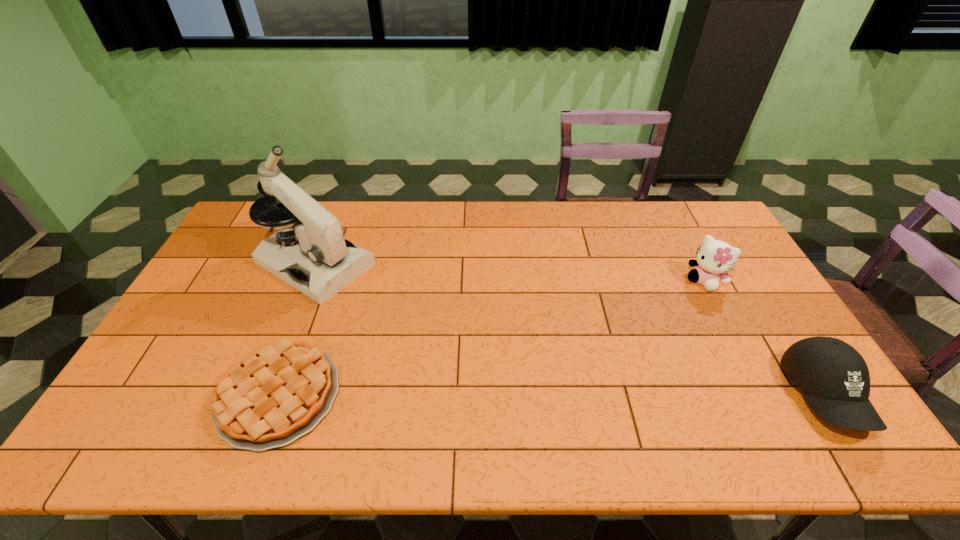
Where is `vacant region located 0.180m at the eyepiece of the microscope`? The height and width of the screenshot is (540, 960). vacant region located 0.180m at the eyepiece of the microscope is located at coordinates (401, 312).

Where is `blank space located at the eyepiece of the microscope`? blank space located at the eyepiece of the microscope is located at coordinates (458, 345).

Identify the location of free space located at the eyepiece of the microscope. (370, 293).

The width and height of the screenshot is (960, 540). In order to click on object that is at the far edge in this screenshot , I will do `click(323, 263)`.

Identify the location of pie at the near edge. (272, 396).

Find the location of a particular element. The width and height of the screenshot is (960, 540). baseball cap that is positioned at the near edge is located at coordinates (835, 379).

What are the coordinates of `object positioned at the left edge` in the screenshot? It's located at (323, 263).

Locate an element on the screen. The height and width of the screenshot is (540, 960). baseball cap located at the right edge is located at coordinates (835, 379).

This screenshot has width=960, height=540. I want to click on kitten present at the right edge, so click(714, 258).

Where is `object that is at the far left corner`? object that is at the far left corner is located at coordinates (323, 263).